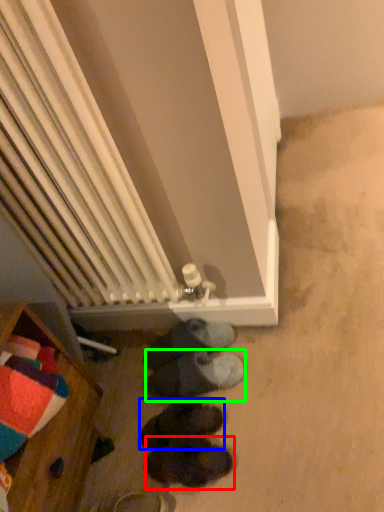
Question: Which is nearer to the footwear (highlighted by a red box)? footwear (highlighted by a blue box) or footwear (highlighted by a green box).

Choices:
 (A) footwear
 (B) footwear

Answer: (A)